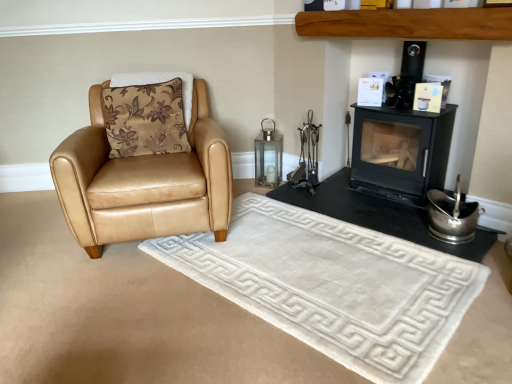
Locate an element on the screen. This screenshot has height=384, width=512. free space between tan leather armchair at left and white plush rug at center is located at coordinates (198, 292).